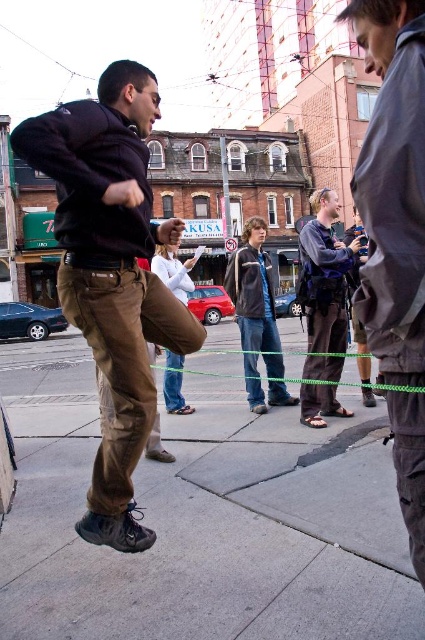
You are standing at the point marked by the coordinates point (203, 520) in the image. What is the surface material under your feet?

The point (203, 520) marks gray concrete sidewalk at center, so the surface material under your feet is gray concrete sidewalk.

You are an event organizer trying to arrange jackets on a rack. You have the gray fabric jacket at right and the dark gray fleece jacket at center. If you want to place them side by side, which one should you place first to ensure they fit properly?

The gray fabric jacket at right has a smaller size compared to the dark gray fleece jacket at center, so you should place the dark gray fleece jacket at center first to accommodate its larger size before placing the smaller gray fabric jacket at right.